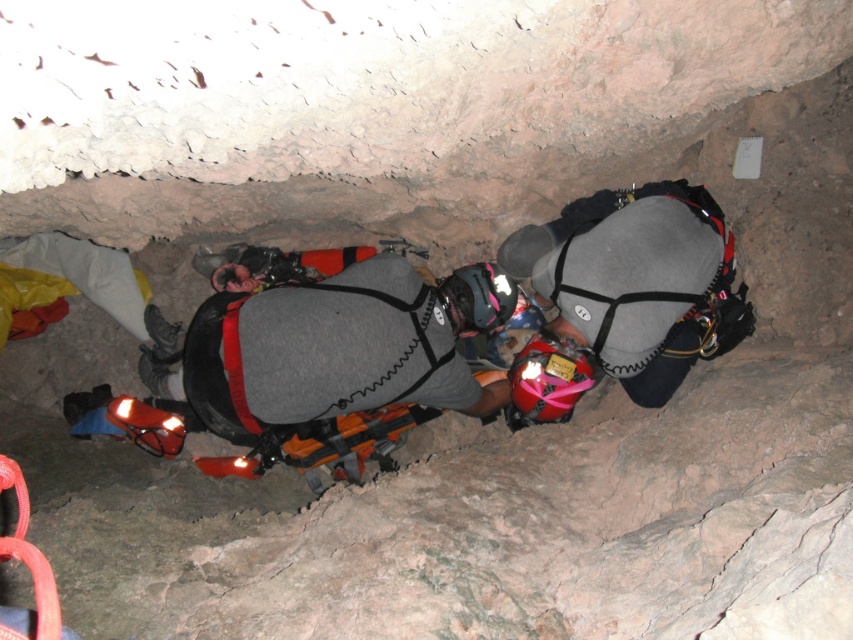
You are a caver preparing to navigate through a narrow cave passage. You have a gray matte vest at center and a gray fabric helmet at center with you. Which item should you remove first to ensure you can pass through the tight space?

The gray matte vest at center is wider than the gray fabric helmet at center, so you should remove the gray matte vest at center first to ensure you can pass through the tight space.

You are a caver preparing to move through the cave passage. You notice the gray matte vest at center and the gray fabric helmet at center in your line of sight. Which object should you adjust your path to avoid first?

The gray matte vest at center is closer to the viewer than the gray fabric helmet at center, so you should adjust your path to avoid the gray matte vest at center first.

You are a caver preparing to navigate a narrow cave passage. You have to decide whether to remove your gray matte vest at center or your gray fabric helmet at center to fit through a tight spot. Which item should you consider removing based on their sizes?

The gray matte vest at center is larger in size than the gray fabric helmet at center, so you should consider removing the gray matte vest at center to fit through the tight spot.